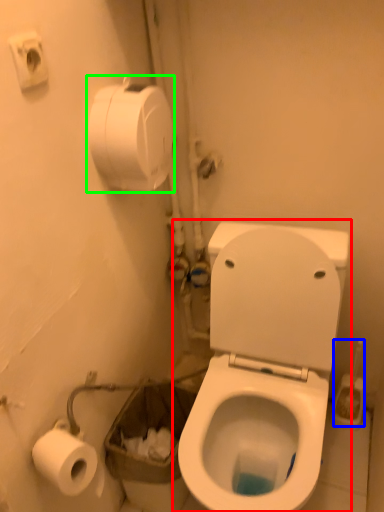
Question: Estimate the real-world distances between objects in this image. Which object is closer to toilet (highlighted by a red box), brush (highlighted by a blue box) or toilet paper (highlighted by a green box)?

Choices:
 (A) brush
 (B) toilet paper

Answer: (A)